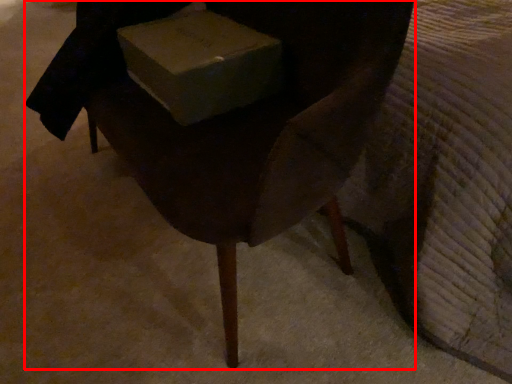
Question: From the image's perspective, considering the relative positions of chair (annotated by the red box) and box in the image provided, where is chair (annotated by the red box) located with respect to the staircase?

Choices:
 (A) above
 (B) below

Answer: (B)